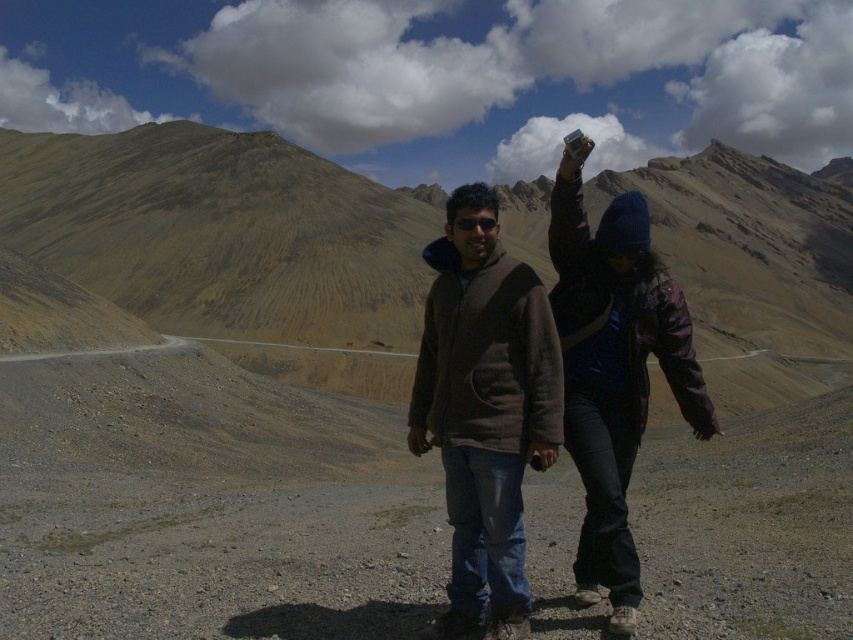
Question: Among these objects, which one is farthest from the camera?

Choices:
 (A) black matte goggles at center
 (B) brown fuzzy jacket at center
 (C) dark brown jacket at center

Answer: (A)

Question: Does brown fuzzy jacket at center have a lesser width compared to black matte goggles at center?

Choices:
 (A) yes
 (B) no

Answer: (B)

Question: Can you confirm if dark brown jacket at center is positioned to the left of black matte goggles at center?

Choices:
 (A) yes
 (B) no

Answer: (B)

Question: Which object appears farthest from the camera in this image?

Choices:
 (A) dark brown jacket at center
 (B) brown fuzzy jacket at center

Answer: (B)

Question: Which of the following is the farthest from the observer?

Choices:
 (A) dark brown jacket at center
 (B) brown fuzzy jacket at center

Answer: (B)

Question: Can you confirm if dark brown jacket at center is thinner than black matte goggles at center?

Choices:
 (A) no
 (B) yes

Answer: (A)